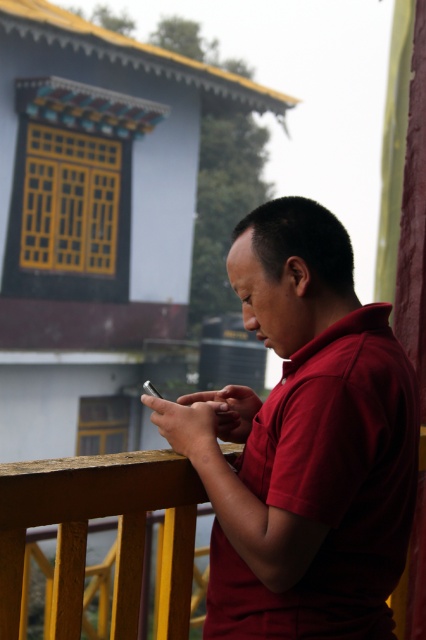
Does matte red shirt at center have a greater width compared to wooden railing at center?

Correct, the width of matte red shirt at center exceeds that of wooden railing at center.

Can you confirm if matte red shirt at center is positioned below wooden railing at center?

No.

At what (x,y) coordinates should I click in order to perform the action: click on matte red shirt at center. Please return your answer as a coordinate pair (x, y). The height and width of the screenshot is (640, 426). Looking at the image, I should click on (305, 444).

The width and height of the screenshot is (426, 640). I want to click on matte red shirt at center, so (305, 444).